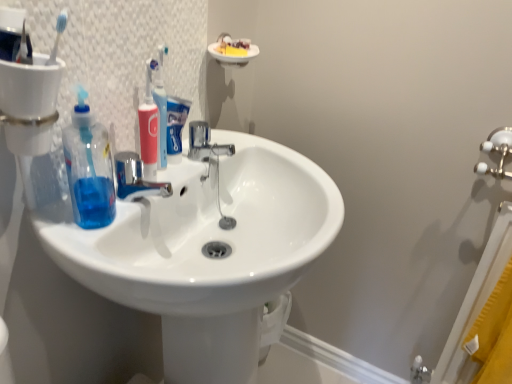
Question: Can we say transparent blue liquid at sink left lies outside white glossy sink at center?

Choices:
 (A) yes
 (B) no

Answer: (A)

Question: Can you confirm if transparent blue liquid at sink left is taller than white glossy sink at center?

Choices:
 (A) yes
 (B) no

Answer: (B)

Question: Can you see transparent blue liquid at sink left touching white glossy sink at center?

Choices:
 (A) no
 (B) yes

Answer: (A)

Question: Does transparent blue liquid at sink left have a lesser width compared to white glossy sink at center?

Choices:
 (A) yes
 (B) no

Answer: (A)

Question: Does transparent blue liquid at sink left appear on the left side of white glossy sink at center?

Choices:
 (A) yes
 (B) no

Answer: (A)

Question: Does transparent blue liquid at sink left turn towards white glossy sink at center?

Choices:
 (A) no
 (B) yes

Answer: (A)

Question: Is chrome metallic faucet at center outside of white glossy sink at center?

Choices:
 (A) yes
 (B) no

Answer: (B)

Question: Does chrome metallic faucet at center have a lesser width compared to white glossy sink at center?

Choices:
 (A) yes
 (B) no

Answer: (A)

Question: Does chrome metallic faucet at center have a greater width compared to white glossy sink at center?

Choices:
 (A) yes
 (B) no

Answer: (B)

Question: From the image's perspective, does chrome metallic faucet at center appear higher than white glossy sink at center?

Choices:
 (A) no
 (B) yes

Answer: (B)

Question: Is chrome metallic faucet at center positioned with its back to white glossy sink at center?

Choices:
 (A) no
 (B) yes

Answer: (B)

Question: Is chrome metallic faucet at center directly adjacent to white glossy sink at center?

Choices:
 (A) no
 (B) yes

Answer: (A)

Question: Can you confirm if transparent blue liquid at sink left is positioned to the left of chrome metallic faucet at center?

Choices:
 (A) no
 (B) yes

Answer: (B)